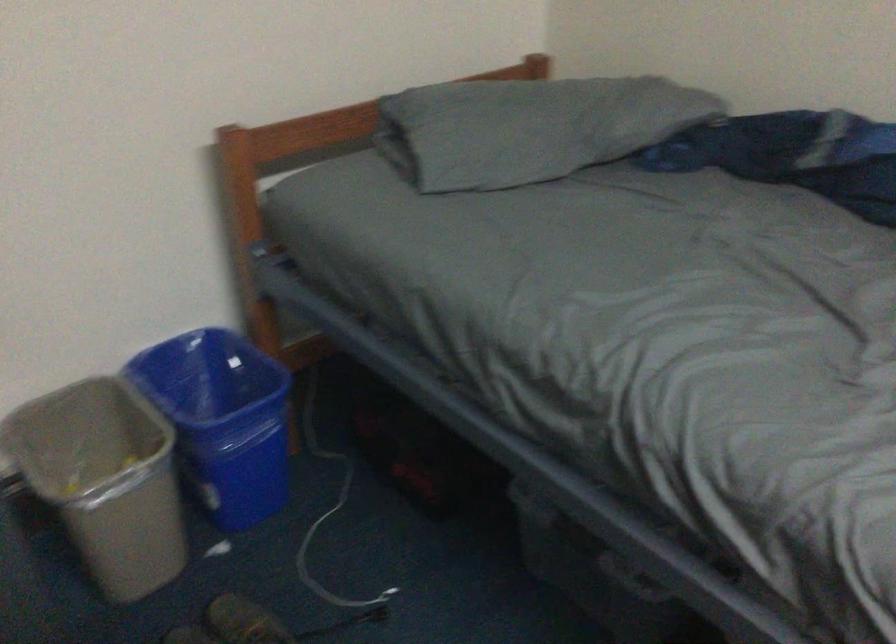
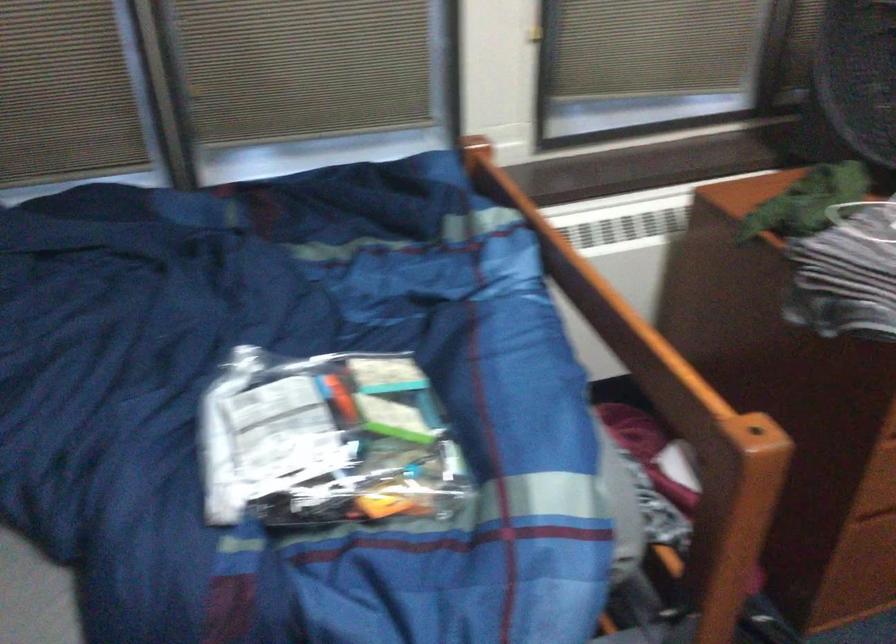
Based on the continuous images, in which direction is the camera rotating?

The camera's rotation is toward right-down.